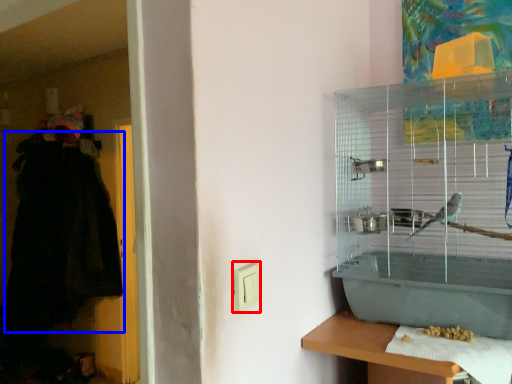
Question: Which object is further to the camera taking this photo, light switch (highlighted by a red box) or robe (highlighted by a blue box)?

Choices:
 (A) light switch
 (B) robe

Answer: (B)